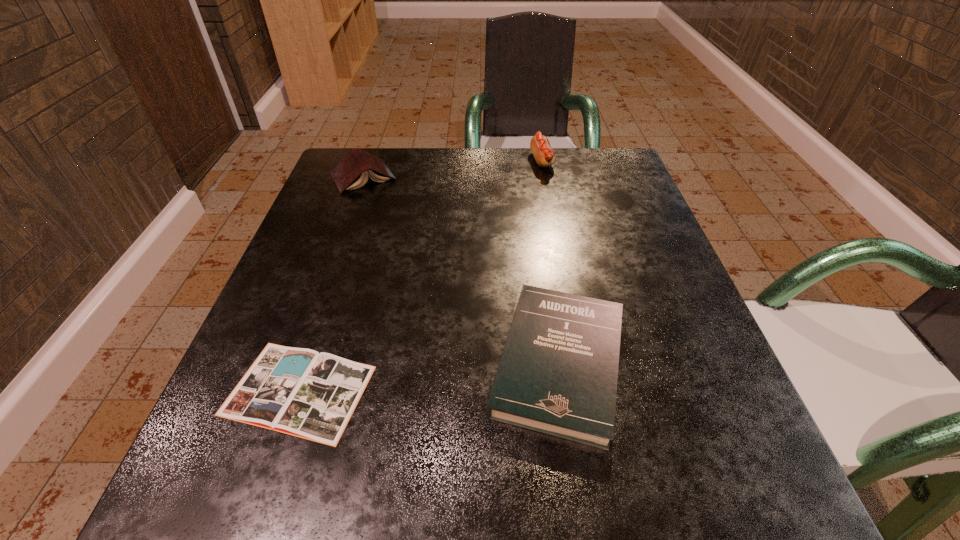
The height and width of the screenshot is (540, 960). Find the location of `sausage`. sausage is located at coordinates click(x=544, y=155).

This screenshot has height=540, width=960. I want to click on the tallest book, so click(352, 171).

Image resolution: width=960 pixels, height=540 pixels. I want to click on the second shortest object, so click(558, 374).

Identify the location of the rightmost book. This screenshot has width=960, height=540. (558, 374).

At what (x,y) coordinates should I click in order to perform the action: click on the shortest object. Please return your answer as a coordinate pair (x, y). The image size is (960, 540). Looking at the image, I should click on (297, 391).

In order to click on vacant space situated on the right of the sausage in this screenshot , I will do `click(615, 161)`.

This screenshot has width=960, height=540. I want to click on free location located 0.380m on the right of the tallest book, so click(562, 177).

I want to click on free space located on the back of the rightmost book, so click(x=546, y=277).

Where is `vacant space located on the back of the shortest book`? The image size is (960, 540). vacant space located on the back of the shortest book is located at coordinates (339, 272).

This screenshot has height=540, width=960. I want to click on sausage located at the far edge, so click(544, 155).